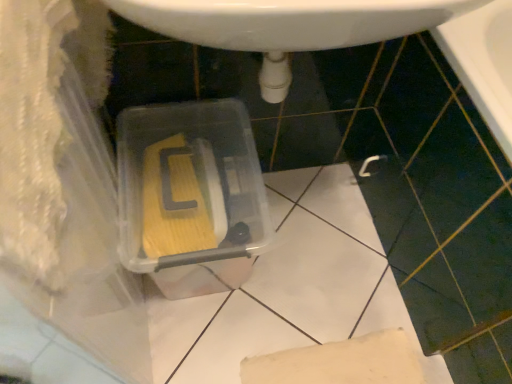
Where is `free point below white glossy sink at center (from a real-world perspective)`? Image resolution: width=512 pixels, height=384 pixels. free point below white glossy sink at center (from a real-world perspective) is located at coordinates (300, 233).